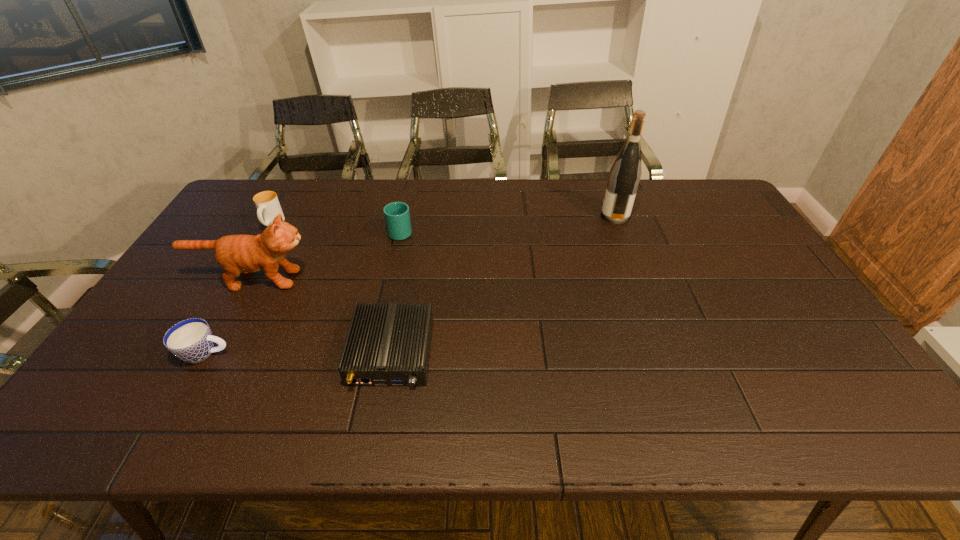
Image resolution: width=960 pixels, height=540 pixels. Find the location of `vacant point located between the wine bottle and the rightmost cup`. vacant point located between the wine bottle and the rightmost cup is located at coordinates (508, 224).

Where is `free area in between the rightmost cup and the nearest cup`? free area in between the rightmost cup and the nearest cup is located at coordinates (303, 292).

I want to click on object that can be found as the second closest to the wine bottle, so click(x=386, y=345).

Identify which object is located as the second nearest to the router. Please provide its 2D coordinates. Your answer should be formatted as a tuple, i.e. [(x, y)], where the tuple contains the x and y coordinates of a point satisfying the conditions above.

[(191, 340)]

Where is `the closest cup relative to the rightmost cup`? This screenshot has height=540, width=960. the closest cup relative to the rightmost cup is located at coordinates (268, 207).

Select which cup appears as the closest to the rightmost cup. Please provide its 2D coordinates. Your answer should be formatted as a tuple, i.e. [(x, y)], where the tuple contains the x and y coordinates of a point satisfying the conditions above.

[(268, 207)]

Where is `free location that satisfies the following two spatial constraints: 1. on the handle side of the rightmost cup; 2. on the left side of the tallest object`? Image resolution: width=960 pixels, height=540 pixels. free location that satisfies the following two spatial constraints: 1. on the handle side of the rightmost cup; 2. on the left side of the tallest object is located at coordinates (404, 216).